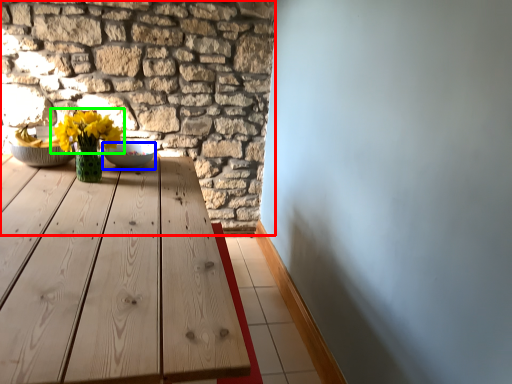
Question: Considering the real-world distances, which object is farthest from brickwork (highlighted by a red box)? bowl (highlighted by a blue box) or flower (highlighted by a green box)?

Choices:
 (A) bowl
 (B) flower

Answer: (A)